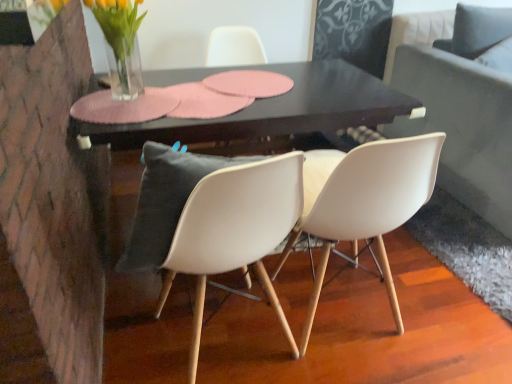
In order to click on white matte chair at center, which is counted as the 2th chair, starting from the front in this screenshot , I will do `click(369, 204)`.

In order to face dark gray fabric couch at right, should I rotate leftwards or rightwards?

Turn right by 33.310 degrees to look at dark gray fabric couch at right.

The width and height of the screenshot is (512, 384). In order to click on clear glass vase at upper left in this screenshot , I will do pyautogui.click(x=121, y=44).

Where is `white plastic chair at center, acting as the third chair starting from the front`? Image resolution: width=512 pixels, height=384 pixels. white plastic chair at center, acting as the third chair starting from the front is located at coordinates (234, 47).

Based on the photo, do you think white plastic chair at center, the first chair in the front-to-back sequence, is within white plastic chair at center, acting as the third chair starting from the front, or outside of it?

white plastic chair at center, the first chair in the front-to-back sequence, is not enclosed by white plastic chair at center, acting as the third chair starting from the front.

Considering the relative positions of white plastic chair at center, the 3th chair viewed from the back, and white plastic chair at center, the first chair from the back, in the image provided, is white plastic chair at center, the 3th chair viewed from the back, to the left or to the right of white plastic chair at center, the first chair from the back,?

In the image, white plastic chair at center, the 3th chair viewed from the back, appears on the left side of white plastic chair at center, the first chair from the back.

Considering the positions of point (157, 152) and point (267, 138), is point (157, 152) closer or farther from the camera than point (267, 138)?

Point (157, 152) is closer to the camera than point (267, 138).

Is point (231, 226) closer or farther from the camera than point (362, 158)?

Point (231, 226) appears to be closer to the viewer than point (362, 158).

Which of these two, white plastic chair at center, the 3th chair viewed from the back, or white matte chair at center, the 2th chair when ordered from back to front, stands shorter?

white plastic chair at center, the 3th chair viewed from the back.

Is white plastic chair at center, the 3th chair viewed from the back, situated inside white matte chair at center, the 2th chair when ordered from back to front, or outside?

white plastic chair at center, the 3th chair viewed from the back, exists outside the volume of white matte chair at center, the 2th chair when ordered from back to front.

In terms of width, does white plastic chair at center, the first chair in the front-to-back sequence, look wider or thinner when compared to white matte chair at center, which is counted as the 2th chair, starting from the front?

Clearly, white plastic chair at center, the first chair in the front-to-back sequence, has more width compared to white matte chair at center, which is counted as the 2th chair, starting from the front.

Is clear glass vase at upper left placed right next to white plastic chair at center, acting as the third chair starting from the front?

No, clear glass vase at upper left is not touching white plastic chair at center, acting as the third chair starting from the front.

From the image's perspective, is clear glass vase at upper left over white plastic chair at center, the first chair from the back?

Yes, from the image's perspective, clear glass vase at upper left is on top of white plastic chair at center, the first chair from the back.

From a real-world perspective, which object stands above the other?

clear glass vase at upper left is physically above.

Is clear glass vase at upper left facing towards white plastic chair at center, acting as the third chair starting from the front?

No, clear glass vase at upper left is not aimed at white plastic chair at center, acting as the third chair starting from the front.

Based on the photo, what's the angular difference between black glossy table at center and clear glass vase at upper left's facing directions?

black glossy table at center and clear glass vase at upper left are facing 0.503 degrees away from each other.

Is black glossy table at center next to clear glass vase at upper left and touching it?

No, black glossy table at center is not in contact with clear glass vase at upper left.

Between black glossy table at center and clear glass vase at upper left, which one is positioned in front?

clear glass vase at upper left.

Which is more to the right, black glossy table at center or clear glass vase at upper left?

From the viewer's perspective, black glossy table at center appears more on the right side.

Can you confirm if black glossy table at center is wider than white plastic chair at center, acting as the third chair starting from the front?

Yes, black glossy table at center is wider than white plastic chair at center, acting as the third chair starting from the front.

Is black glossy table at center with white plastic chair at center, acting as the third chair starting from the front?

black glossy table at center and white plastic chair at center, acting as the third chair starting from the front, are not in contact.

From a real-world perspective, who is located lower, black glossy table at center or white plastic chair at center, the first chair from the back?

From a 3D spatial view, black glossy table at center is below.

Can white plastic chair at center, the first chair from the back, be found inside black glossy table at center?

No, white plastic chair at center, the first chair from the back, is not a part of black glossy table at center.

From a real-world perspective, is dark gray fabric couch at right above or below white matte chair at center, which is counted as the 2th chair, starting from the front?

dark gray fabric couch at right is situated lower than white matte chair at center, which is counted as the 2th chair, starting from the front, in the real world.

Considering the sizes of objects dark gray fabric couch at right and white matte chair at center, which is counted as the 2th chair, starting from the front, in the image provided, who is thinner, dark gray fabric couch at right or white matte chair at center, which is counted as the 2th chair, starting from the front,?

white matte chair at center, which is counted as the 2th chair, starting from the front.

Is dark gray fabric couch at right next to white matte chair at center, the 2th chair when ordered from back to front?

dark gray fabric couch at right and white matte chair at center, the 2th chair when ordered from back to front, are not in contact.

What's the angular difference between dark gray fabric couch at right and white matte chair at center, which is counted as the 2th chair, starting from the front,'s facing directions?

173 degrees separate the facing orientations of dark gray fabric couch at right and white matte chair at center, which is counted as the 2th chair, starting from the front.

From the image's perspective, which one is positioned higher, dark gray fabric couch at right or black glossy table at center?

From the image's view, dark gray fabric couch at right is above.

From a real-world perspective, which is physically above, dark gray fabric couch at right or black glossy table at center?

dark gray fabric couch at right, from a real-world perspective.

Between dark gray fabric couch at right and black glossy table at center, which one has smaller width?

Thinner between the two is black glossy table at center.

Considering the sizes of dark gray fabric couch at right and black glossy table at center in the image, is dark gray fabric couch at right taller or shorter than black glossy table at center?

dark gray fabric couch at right is taller than black glossy table at center.

Image resolution: width=512 pixels, height=384 pixels. There is a white plastic chair at center, the first chair in the front-to-back sequence. Find the location of `the 2nd chair above it (from the image's perspective)`. the 2nd chair above it (from the image's perspective) is located at coordinates (234, 47).

Starting from the white matte chair at center, which is counted as the 2th chair, starting from the front, which chair is the 2nd one to the left? Please provide its 2D coordinates.

[(212, 221)]

Estimate the real-world distances between objects in this image. Which object is further from white matte chair at center, the 2th chair when ordered from back to front, clear glass vase at upper left or white plastic chair at center, the first chair in the front-to-back sequence?

clear glass vase at upper left lies further to white matte chair at center, the 2th chair when ordered from back to front, than the other object.

From the image, which object appears to be farther from black glossy table at center, white plastic chair at center, the first chair from the back, or white matte chair at center, which is counted as the 2th chair, starting from the front?

white matte chair at center, which is counted as the 2th chair, starting from the front, lies further to black glossy table at center than the other object.

Consider the image. Estimate the real-world distances between objects in this image. Which object is closer to white matte chair at center, which is counted as the 2th chair, starting from the front, black glossy table at center or dark gray fabric couch at right?

Based on the image, black glossy table at center appears to be nearer to white matte chair at center, which is counted as the 2th chair, starting from the front.

Estimate the real-world distances between objects in this image. Which object is closer to white plastic chair at center, the first chair from the back, white matte chair at center, which is counted as the 2th chair, starting from the front, or black glossy table at center?

black glossy table at center is closer to white plastic chair at center, the first chair from the back.

Which object lies nearer to the anchor point dark gray fabric couch at right, clear glass vase at upper left or white matte chair at center, which is counted as the 2th chair, starting from the front?

Based on the image, white matte chair at center, which is counted as the 2th chair, starting from the front, appears to be nearer to dark gray fabric couch at right.

Which object lies further to the anchor point white matte chair at center, the 2th chair when ordered from back to front, dark gray fabric couch at right or white plastic chair at center, the 3th chair viewed from the back?

The object further to white matte chair at center, the 2th chair when ordered from back to front, is dark gray fabric couch at right.

Looking at the image, which one is located closer to white plastic chair at center, the first chair from the back, clear glass vase at upper left or black glossy table at center?

black glossy table at center.

From the image, which object appears to be farther from white plastic chair at center, acting as the third chair starting from the front, clear glass vase at upper left or white plastic chair at center, the first chair in the front-to-back sequence?

white plastic chair at center, the first chair in the front-to-back sequence, is further to white plastic chair at center, acting as the third chair starting from the front.

Identify the location of table between clear glass vase at upper left and dark gray fabric couch at right from left to right. This screenshot has height=384, width=512. (264, 110).

You are a GUI agent. You are given a task and a screenshot of the screen. Output one action in this format:
    pyautogui.click(x=<x>, y=<y>)
    Task: Click on the table between clear glass vase at upper left and white plastic chair at center, the first chair in the front-to-back sequence, in the up-down direction
    This screenshot has height=384, width=512.
    Given the screenshot: What is the action you would take?
    pyautogui.click(x=264, y=110)

Locate an element on the screen. The image size is (512, 384). chair between white plastic chair at center, the first chair in the front-to-back sequence, and white plastic chair at center, acting as the third chair starting from the front, in the front-back direction is located at coordinates (369, 204).

I want to click on table positioned between clear glass vase at upper left and white plastic chair at center, acting as the third chair starting from the front, from near to far, so click(264, 110).